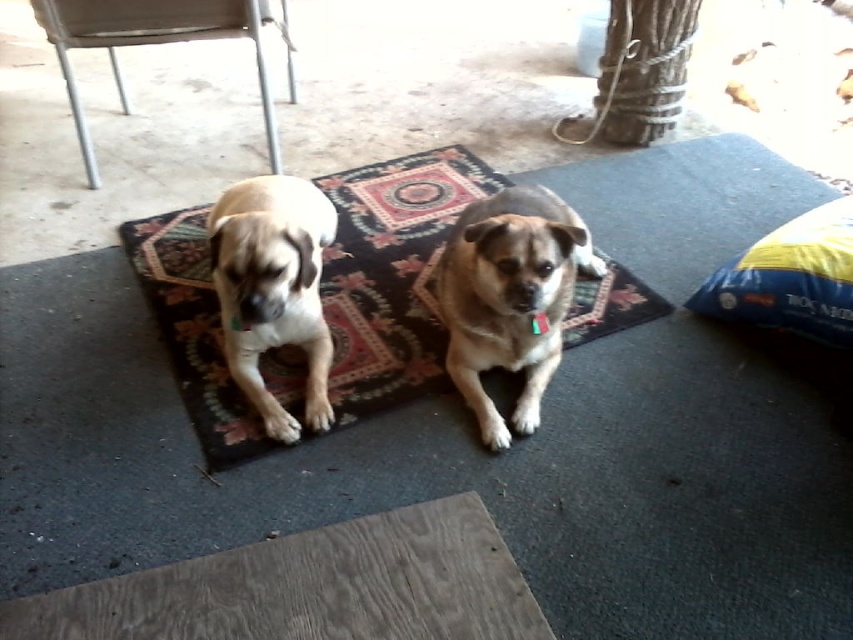
You are standing 5 feet away from the brown furry dog at center. Can you reach it without moving your feet?

The brown furry dog at center is 4.22 feet away from the viewer, so yes, you can reach it without moving your feet since it is within the 5 feet distance.

You are a small robot with a width of 18 inches. You are on the patterned carpet at center and want to reach the yellow fabric pillow at right. Can you move directly to it without hitting anything?

The distance between the patterned carpet at center and the yellow fabric pillow at right is 29.01 inches. Since your width is 18 inches, you can move directly to it without any issues as there is enough space between them.